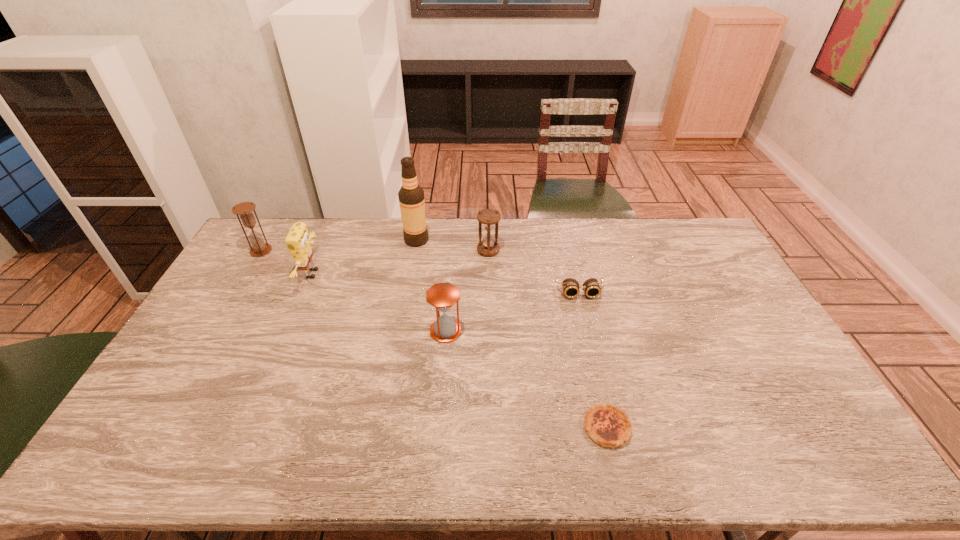
The image size is (960, 540). I want to click on vacant space located on the label of the alcohol, so click(442, 240).

Image resolution: width=960 pixels, height=540 pixels. I want to click on blank area located on the back of the leftmost hourglass, so click(x=270, y=237).

Where is `vacant area situated on the face of the second object from left to right`? This screenshot has height=540, width=960. vacant area situated on the face of the second object from left to right is located at coordinates (338, 274).

Where is `free space located 0.080m on the front of the rightmost hourglass`? free space located 0.080m on the front of the rightmost hourglass is located at coordinates (489, 272).

In order to click on vacant space situated on the front of the second hourglass from left to right in this screenshot , I will do `click(440, 402)`.

This screenshot has height=540, width=960. In order to click on vacant area situated 0.110m through the lenses of the goggles in this screenshot , I will do `click(588, 326)`.

In order to click on vacant space located 0.340m on the right of the nearest object in this screenshot , I will do click(x=764, y=428).

Locate an element on the screen. This screenshot has height=540, width=960. alcohol present at the far edge is located at coordinates (411, 196).

The image size is (960, 540). I want to click on sponge situated at the far edge, so click(298, 242).

Image resolution: width=960 pixels, height=540 pixels. In order to click on object at the near edge in this screenshot , I will do `click(609, 426)`.